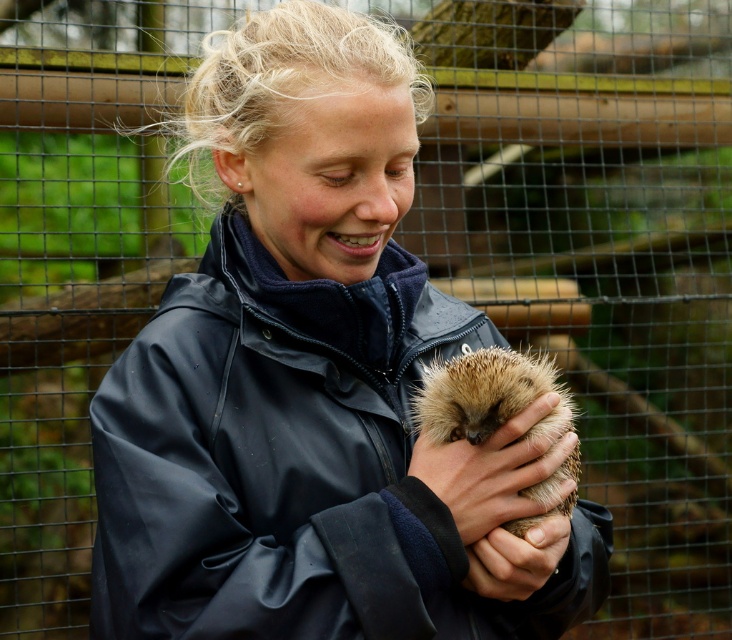
Between brown fuzzy hedgehog at center and smooth brown hand at center, which one appears on the right side from the viewer's perspective?

smooth brown hand at center is more to the right.

Between point (522, 388) and point (498, 531), which one is positioned behind?

Positioned behind is point (498, 531).

Where is `brown fuzzy hedgehog at center`? brown fuzzy hedgehog at center is located at coordinates tap(488, 396).

Does dark blue waterproof jacket at center appear over brown fuzzy hedgehog at center?

Actually, dark blue waterproof jacket at center is below brown fuzzy hedgehog at center.

Which of these two, dark blue waterproof jacket at center or brown fuzzy hedgehog at center, stands shorter?

With less height is brown fuzzy hedgehog at center.

What are the coordinates of `dark blue waterproof jacket at center` in the screenshot? It's located at (295, 465).

Does dark blue waterproof jacket at center appear on the right side of smooth brown hand at center?

No, dark blue waterproof jacket at center is not to the right of smooth brown hand at center.

Can you confirm if dark blue waterproof jacket at center is thinner than smooth brown hand at center?

Incorrect, dark blue waterproof jacket at center's width is not less than smooth brown hand at center's.

Is point (498, 611) positioned after point (522, 547)?

Yes, point (498, 611) is behind point (522, 547).

At what (x,y) coordinates should I click in order to perform the action: click on dark blue waterproof jacket at center. Please return your answer as a coordinate pair (x, y). The width and height of the screenshot is (732, 640). Looking at the image, I should click on tap(295, 465).